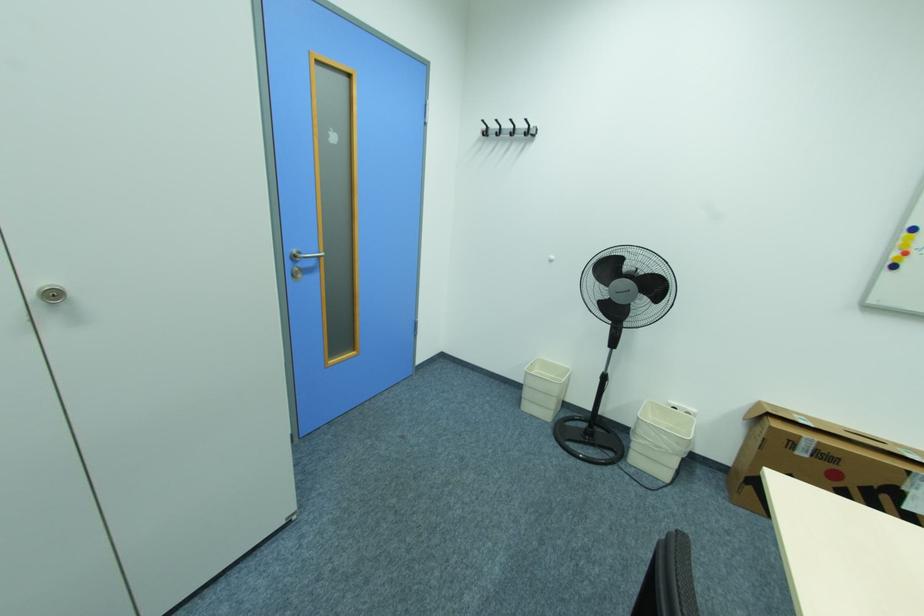
The height and width of the screenshot is (616, 924). What do you see at coordinates (52, 294) in the screenshot?
I see `a door keyhole` at bounding box center [52, 294].